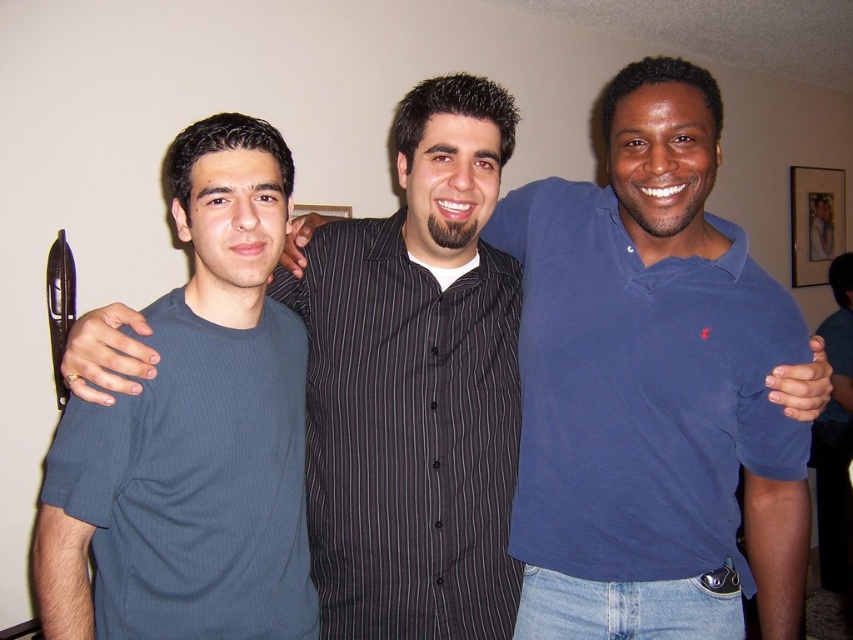
You are trying to decide whether to hang a new painting that is 1.2 meters wide on the wall. You see the black striped shirt at center and the wooden framed portrait at upper right in the scene. Based on their widths, can you determine if the new painting will fit between them?

The black striped shirt at center is narrower than the wooden framed portrait at upper right. However, since the exact widths aren

You are taking a photo of three friends standing together. You notice a point at coordinates (407, 435). Which friend is closest to that point?

The point at coordinates (407, 435) marks the black striped shirt at center, so the friend in the middle is closest to that point.